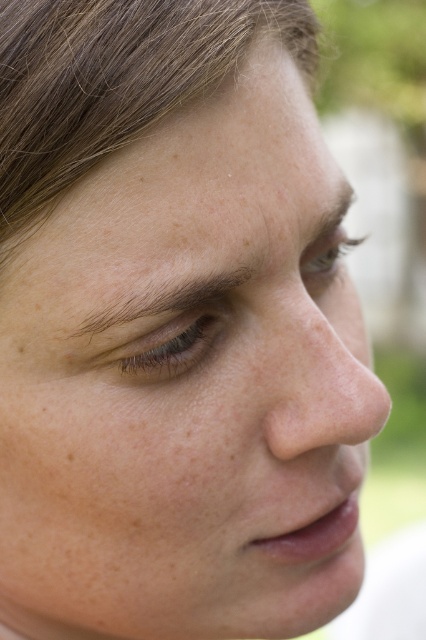
Based on the photo, you are a photographer adjusting the lighting for a portrait. You notice the brown smooth hair at upper left and the light brown eye at upper center. Which object is located to the left of the other?

The brown smooth hair at upper left is positioned on the left side of light brown eye at upper center.

You are an artist trying to sketch this face. The brown smooth hair at upper left is crucial for the composition. Where exactly should you place it on your canvas? Provide coordinates in the format of a point like this example format for reference, but do not explain the coordinates.

The brown smooth hair at upper left should be placed at point (x=114, y=81).

From the picture: You are a photographer adjusting the camera focus. You need to ensure that both the brown matte eye at center and the brown hair at upper left are in focus. Given that the camera can only sharply focus on objects within a 0.5 inch depth of field, will both objects be in focus?

The brown matte eye at center is 0.33 inches away from brown hair at upper left. Since the distance between them is less than the 0.5 inch depth of field, both objects will be in focus.